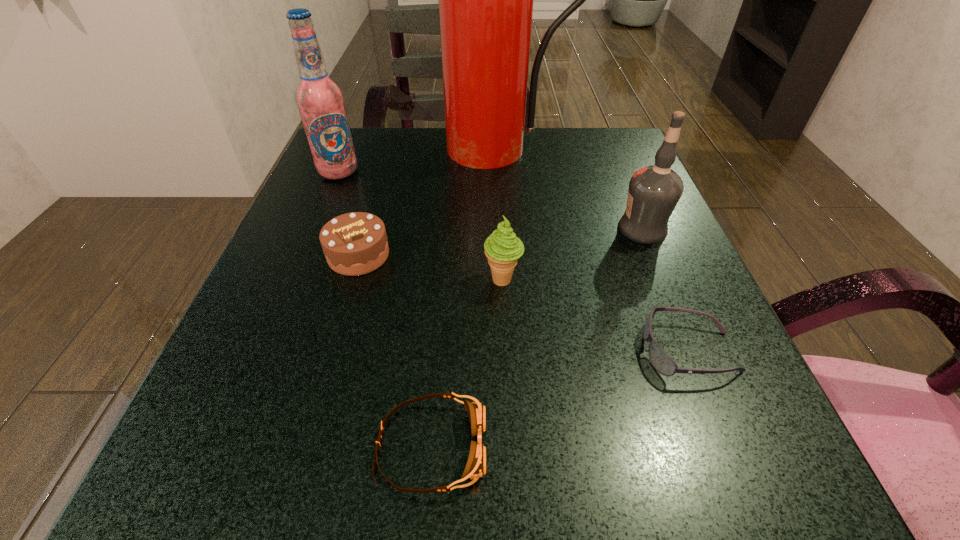
You are a GUI agent. You are given a task and a screenshot of the screen. Output one action in this format:
    pyautogui.click(x=<x>, y=<y>)
    Task: Click on the vacant point located between the sixth shortest object and the fire extinguisher
    This screenshot has width=960, height=540.
    Given the screenshot: What is the action you would take?
    pyautogui.click(x=420, y=160)

In order to click on vacant space that's between the goggles and the fifth tallest object in this screenshot , I will do `click(395, 350)`.

Locate an element on the screen. The height and width of the screenshot is (540, 960). free spot between the fourth shortest object and the tallest object is located at coordinates (502, 214).

Locate which object is the second closest to the tallest object. Please provide its 2D coordinates. Your answer should be formatted as a tuple, i.e. [(x, y)], where the tuple contains the x and y coordinates of a point satisfying the conditions above.

[(654, 191)]

Locate which object is the fifth closest to the third tallest object. Please provide its 2D coordinates. Your answer should be formatted as a tuple, i.e. [(x, y)], where the tuple contains the x and y coordinates of a point satisfying the conditions above.

[(356, 243)]

The image size is (960, 540). I want to click on vacant space that satisfies the following two spatial constraints: 1. on the front side of the icecream; 2. on the right side of the sixth shortest object, so click(x=293, y=279).

In order to click on vacant space that satisfies the following two spatial constraints: 1. on the front side of the fourth shortest object; 2. on the right side of the chocolate cake in this screenshot , I will do `click(351, 279)`.

Identify the location of vacant position in the image that satisfies the following two spatial constraints: 1. with the handle and nozzle on the fire extinguisher; 2. with the lenses facing forward on the nearest object. (523, 446).